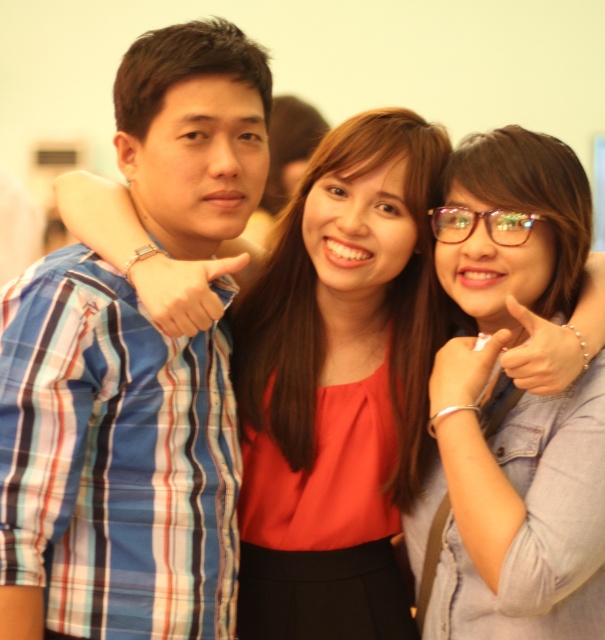
Can you confirm if blue plaid shirt at left is thinner than matte blue plaid shirt at center?

In fact, blue plaid shirt at left might be wider than matte blue plaid shirt at center.

Is blue plaid shirt at left bigger than matte blue plaid shirt at center?

Yes, blue plaid shirt at left is bigger than matte blue plaid shirt at center.

Find the location of `blue plaid shirt at left`. blue plaid shirt at left is located at coordinates (111, 464).

Can you confirm if pearl bracelet at upper center is smaller than transparent plastic glasses at center?

Incorrect, pearl bracelet at upper center is not smaller in size than transparent plastic glasses at center.

What do you see at coordinates (551, 348) in the screenshot? I see `pearl bracelet at upper center` at bounding box center [551, 348].

You are a GUI agent. You are given a task and a screenshot of the screen. Output one action in this format:
    pyautogui.click(x=<x>, y=<y>)
    Task: Click on the pearl bracelet at upper center
    The width and height of the screenshot is (605, 640).
    Given the screenshot: What is the action you would take?
    pyautogui.click(x=551, y=348)

Is matte silver bracelet at center bigger than transparent plastic glasses at center?

Yes, matte silver bracelet at center is bigger than transparent plastic glasses at center.

In the scene shown: Who is lower down, matte silver bracelet at center or transparent plastic glasses at center?

matte silver bracelet at center

The image size is (605, 640). Describe the element at coordinates (462, 372) in the screenshot. I see `matte silver bracelet at center` at that location.

This screenshot has width=605, height=640. Identify the location of matte silver bracelet at center. coord(462,372).